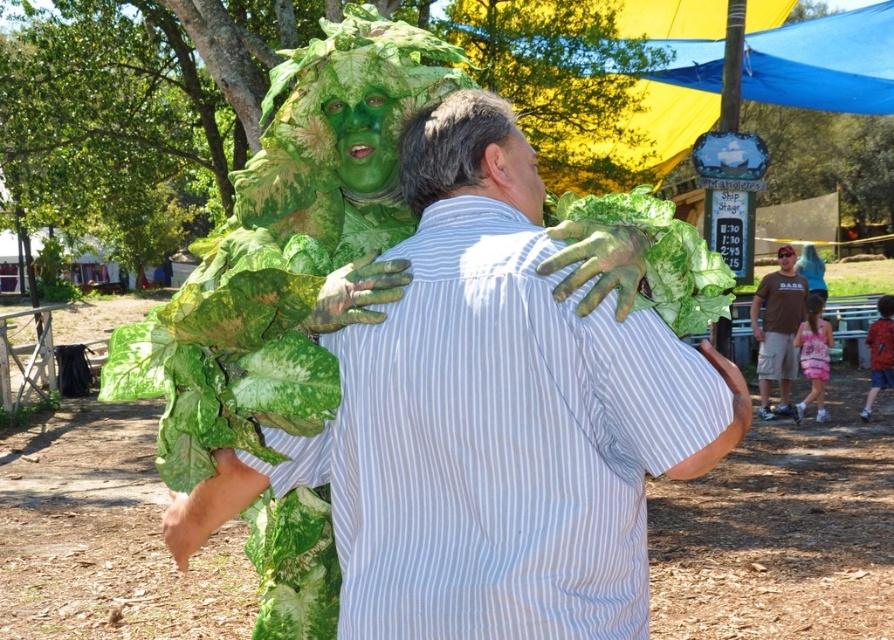
Is red plaid shirt at right below red textured shirt at center?

Yes.

I want to click on red plaid shirt at right, so click(x=879, y=353).

Between point (426, 273) and point (688, 225), which one is positioned in front?

Point (426, 273) is in front.

Which is more to the right, matte green costume at center or green matte leaf at upper center?

green matte leaf at upper center

Is point (492, 269) positioned before point (672, 278)?

That is True.

You are a GUI agent. You are given a task and a screenshot of the screen. Output one action in this format:
    pyautogui.click(x=<x>, y=<y>)
    Task: Click on the matte green costume at center
    The width and height of the screenshot is (894, 640).
    Given the screenshot: What is the action you would take?
    pyautogui.click(x=488, y=420)

Between pink satin dress at lower right and red textured shirt at center, which one is positioned lower?

Positioned lower is pink satin dress at lower right.

In the scene shown: Can you confirm if pink satin dress at lower right is positioned below red textured shirt at center?

Indeed, pink satin dress at lower right is positioned under red textured shirt at center.

Between point (806, 324) and point (869, 337), which one is positioned behind?

The point (869, 337) is behind.

Where is `pink satin dress at lower right`? This screenshot has height=640, width=894. pink satin dress at lower right is located at coordinates (814, 356).